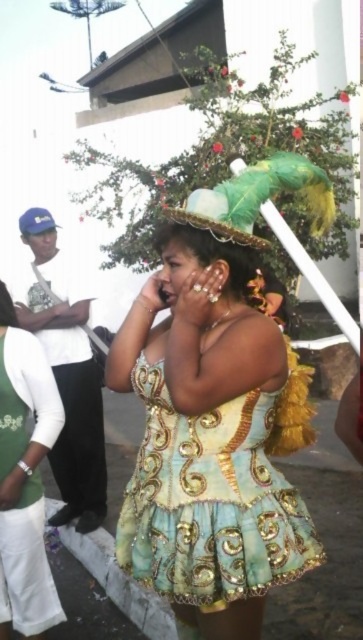
Question: Is shiny gold dress at center below green feathered hat at upper center?

Choices:
 (A) yes
 (B) no

Answer: (A)

Question: Which point is farther to the camera?

Choices:
 (A) (189, 604)
 (B) (284, 156)

Answer: (B)

Question: Which of these objects is positioned farthest from the green satin dress at center?

Choices:
 (A) green feathered hat at upper center
 (B) shiny gold dress at center

Answer: (A)

Question: Considering the relative positions of shiny gold dress at center and green feathered hat at upper center in the image provided, where is shiny gold dress at center located with respect to green feathered hat at upper center?

Choices:
 (A) above
 (B) below

Answer: (B)

Question: From the image, what is the correct spatial relationship of green satin dress at center in relation to green feathered hat at upper center?

Choices:
 (A) right
 (B) left

Answer: (B)

Question: Estimate the real-world distances between objects in this image. Which object is farther from the green feathered hat at upper center?

Choices:
 (A) green satin dress at center
 (B) shiny gold dress at center

Answer: (A)